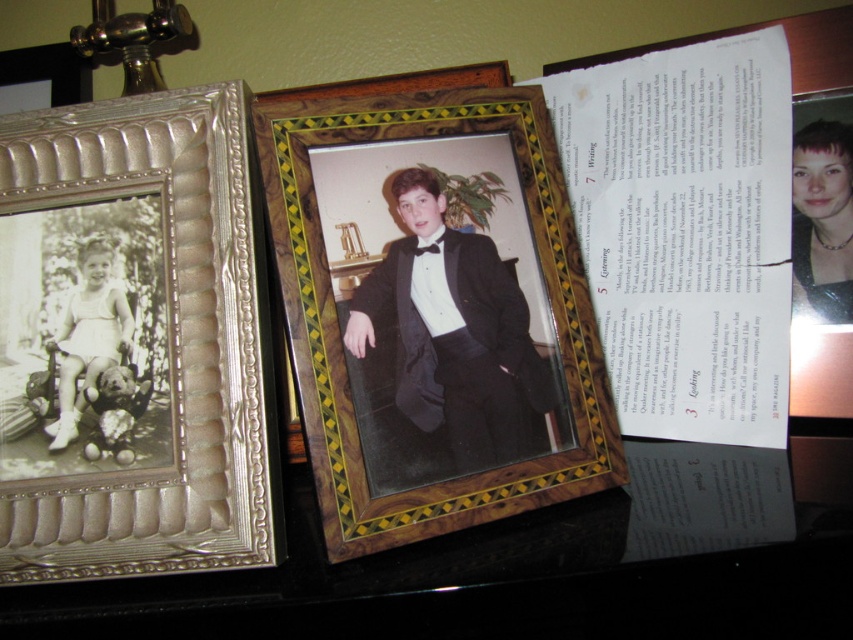
You are a tailor who needs to determine if a mannequin can fit both the black satin tuxedo at center and the matte black dress at upper right on a 1.5 meter wide display stand. Can both items fit side by side?

The black satin tuxedo at center is wider than the matte black dress at upper right. If the combined width of both items is less than or equal to 1.5 meters, they can fit. However, since the tuxedo is wider, it depends on their exact dimensions. Without specific measurements, we cannot confirm.

You are arranging items on a desk and see the wooden with inlaid patterns at center and the black glossy table at center. Which object is positioned to the left?

The wooden with inlaid patterns at center is to the left of the black glossy table at center according to the description.